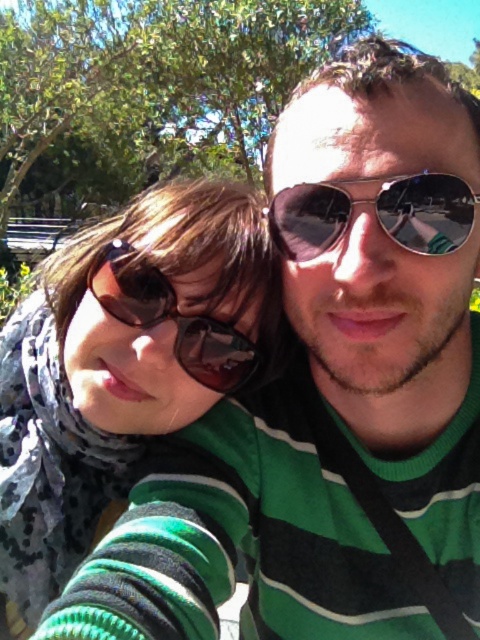
Which is above, metallic aviator sunglasses at center or brown reflective sunglasses at left?

metallic aviator sunglasses at center

Is point (328, 230) in front of point (241, 381)?

Yes.

You are a GUI agent. You are given a task and a screenshot of the screen. Output one action in this format:
    pyautogui.click(x=<x>, y=<y>)
    Task: Click on the metallic aviator sunglasses at center
    
    Given the screenshot: What is the action you would take?
    pyautogui.click(x=374, y=212)

Is point (207, 237) positioned in front of point (117, 285)?

No, it is not.

Is matte black sunglasses at upper left in front of brown reflective sunglasses at left?

No, matte black sunglasses at upper left is behind brown reflective sunglasses at left.

Is point (40, 310) positioned in front of point (167, 298)?

No, it is behind (167, 298).

Where is `matte black sunglasses at upper left`? matte black sunglasses at upper left is located at coordinates (121, 365).

Is matte black sunglasses at upper left taller than metallic aviator sunglasses at center?

Correct, matte black sunglasses at upper left is much taller as metallic aviator sunglasses at center.

Can you confirm if matte black sunglasses at upper left is positioned to the left of metallic aviator sunglasses at center?

Correct, you'll find matte black sunglasses at upper left to the left of metallic aviator sunglasses at center.

Is point (227, 268) positioned after point (416, 202)?

Yes, point (227, 268) is farther from viewer.

Find the location of a particular element. Image resolution: width=480 pixels, height=640 pixels. matte black sunglasses at upper left is located at coordinates (121, 365).